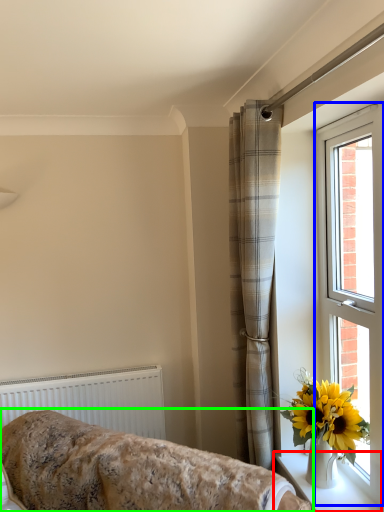
Question: Which object is positioned farthest from window sill (highlighted by a red box)? Select from window (highlighted by a blue box) and furniture (highlighted by a green box).

Choices:
 (A) window
 (B) furniture

Answer: (B)